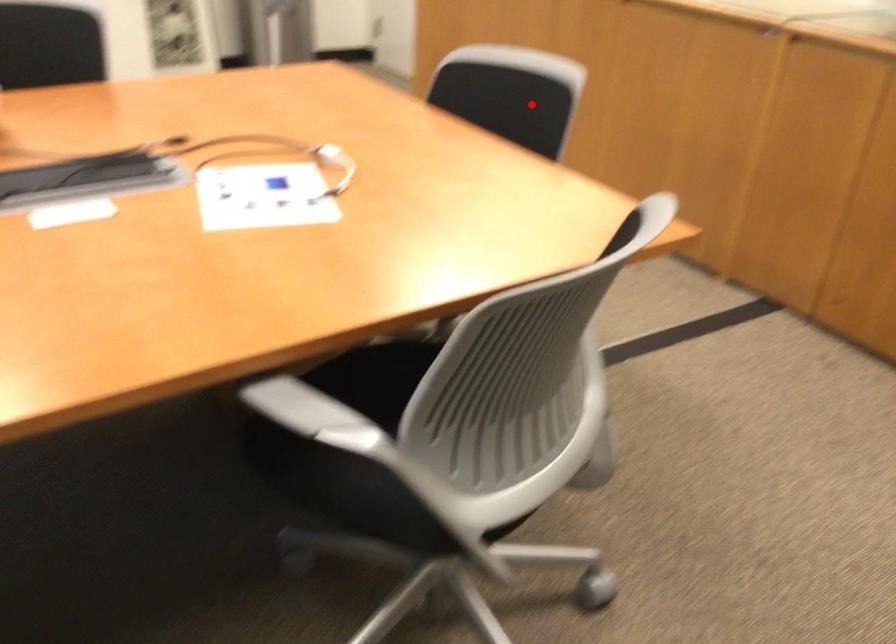
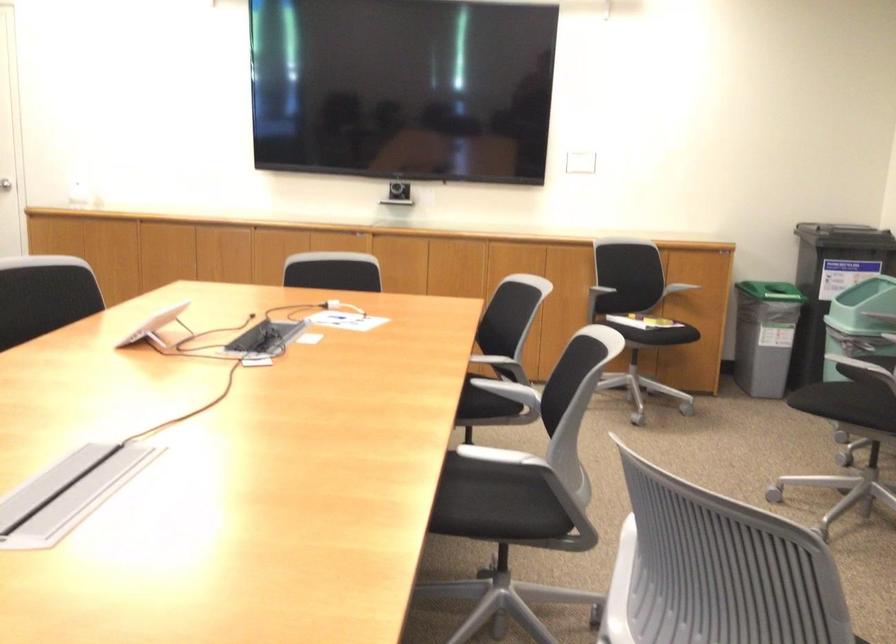
Find the pixel in the second image that matches the highlighted location in the first image.

(332, 272)